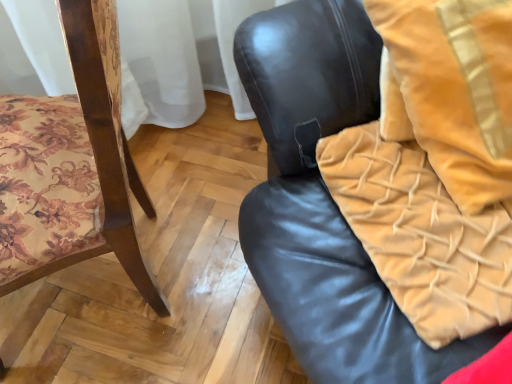
Question: Considering the positions of black leather chair at center, the second chair from the left, and velvet yellow blanket at right in the image, is black leather chair at center, the second chair from the left, bigger or smaller than velvet yellow blanket at right?

Choices:
 (A) big
 (B) small

Answer: (A)

Question: From a real-world perspective, is black leather chair at center, the first chair positioned from the right, physically located above or below velvet yellow blanket at right?

Choices:
 (A) above
 (B) below

Answer: (B)

Question: Which is farther from the wooden floral-patterned chair at left, placed as the 1th chair when sorted from left to right?

Choices:
 (A) black leather chair at center, the first chair positioned from the right
 (B) velvet gold throw pillow at upper right
 (C) velvet yellow blanket at right

Answer: (B)

Question: Based on their relative distances, which object is nearer to the velvet gold throw pillow at upper right?

Choices:
 (A) velvet yellow blanket at right
 (B) wooden floral-patterned chair at left, placed as the 1th chair when sorted from left to right
 (C) black leather chair at center, the second chair from the left

Answer: (A)